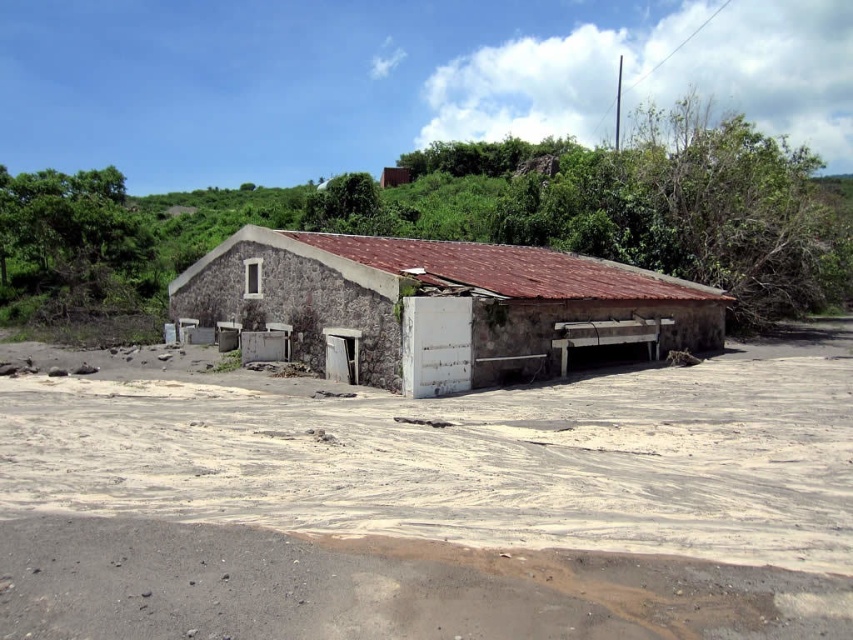
You are standing at the entrance of the rustic building and want to place a small potted plant exactly at the center of the white sandy dirt at center. According to the coordinates provided, where should you place the plant?

The white sandy dirt at center is located at point (428,504), so you should place the plant at those coordinates.

You are standing in front of the stone textured hut at center and want to cross to the other side. The brown sandy ground at lower center is the only path available. Can you walk across it comfortably?

The brown sandy ground at lower center is narrower than the stone textured hut at center, so it might be challenging to walk across comfortably due to its limited width.

In the scene shown: You are a construction worker who needs to pour a concrete slab. You have two areas to choose from, the white sandy dirt at center and the brown sandy ground at lower center. Which area has higher elevation for better drainage?

The white sandy dirt at center is taller than brown sandy ground at lower center, so it has higher elevation and better drainage.